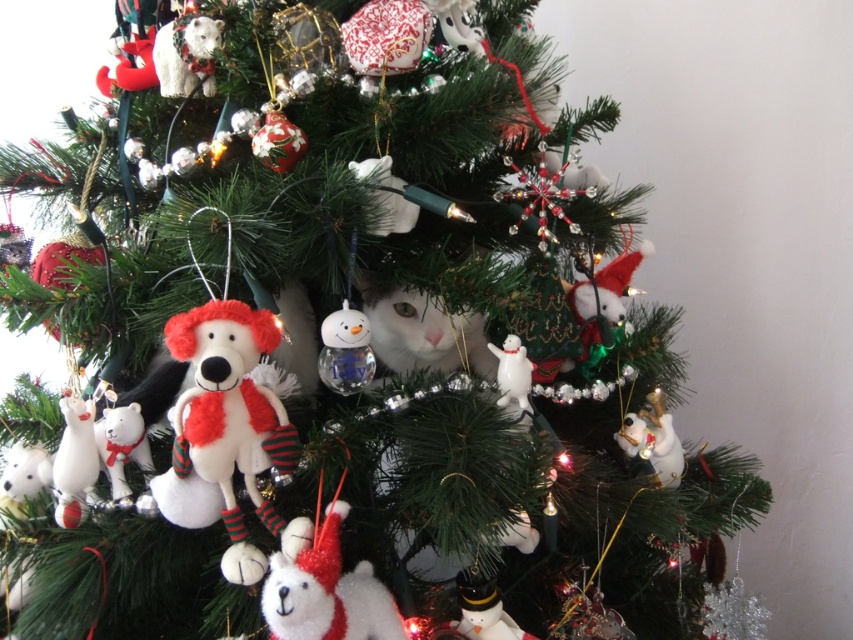
Is white plush bear at lower center above white glossy dog at lower right?

No.

Describe the element at coordinates (328, 593) in the screenshot. I see `white plush bear at lower center` at that location.

Locate an element on the screen. This screenshot has height=640, width=853. white plush bear at lower center is located at coordinates (328, 593).

Which is more to the right, white plush dog at center or white plush bear at left?

From the viewer's perspective, white plush dog at center appears more on the right side.

Can you confirm if white plush dog at center is shorter than white plush bear at left?

Incorrect, white plush dog at center's height does not fall short of white plush bear at left's.

Does point (195, 387) come farther from viewer compared to point (120, 444)?

No, (195, 387) is closer to viewer.

Locate an element on the screen. white plush dog at center is located at coordinates (229, 428).

Who is more forward, (x=173, y=81) or (x=625, y=419)?

Positioned in front is point (x=173, y=81).

Does point (160, 84) lie behind point (663, 426)?

No, (160, 84) is closer to viewer.

Is point (180, 81) closer to viewer compared to point (662, 458)?

That is True.

Where is `white plush bear at upper left`? The image size is (853, 640). white plush bear at upper left is located at coordinates (186, 54).